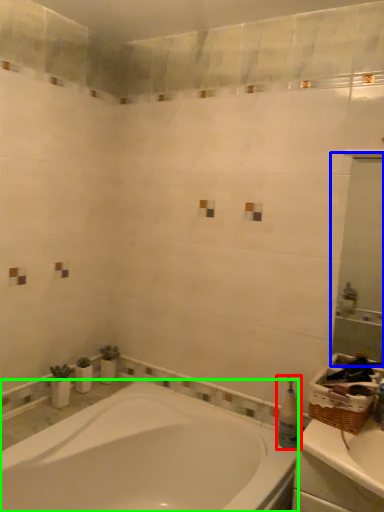
Question: Which is farther away from toiletry (highlighted by a red box)? mirror (highlighted by a blue box) or bathtub (highlighted by a green box)?

Choices:
 (A) mirror
 (B) bathtub

Answer: (A)